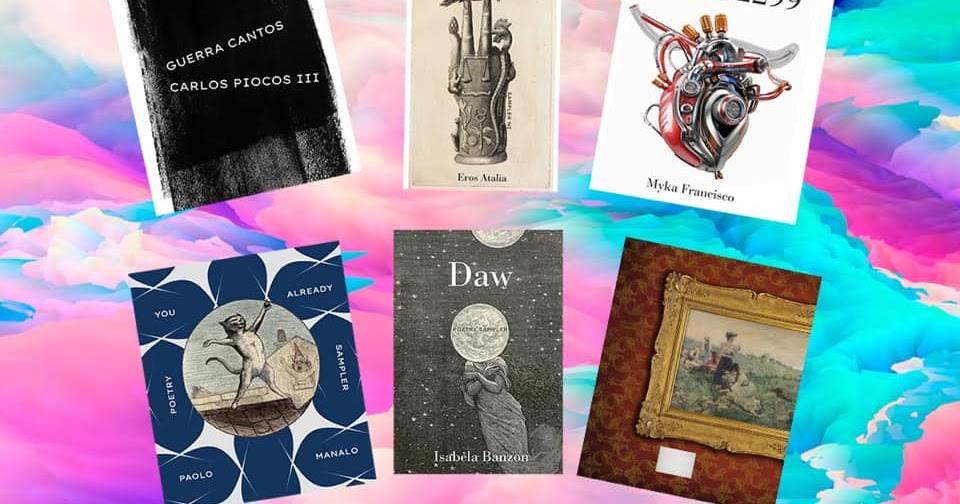
The image size is (960, 504). I want to click on books, so click(307, 333), click(529, 324), click(643, 336), click(739, 148), click(530, 162), click(256, 132).